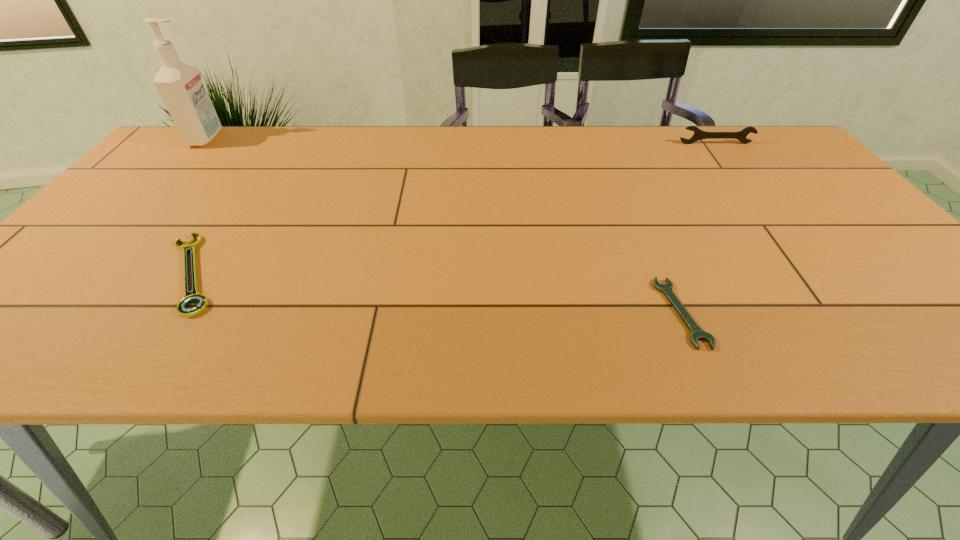
The width and height of the screenshot is (960, 540). Find the location of `object that is the third closest to the tallest wrench`. object that is the third closest to the tallest wrench is located at coordinates (179, 84).

Image resolution: width=960 pixels, height=540 pixels. Find the location of `object that stands as the closest to the third shortest object`. object that stands as the closest to the third shortest object is located at coordinates (696, 333).

What are the coordinates of `the second closest wrench to the tallest wrench` in the screenshot? It's located at (192, 298).

In order to click on wrench that is the closest to the second wrench from right to left in this screenshot , I will do `click(698, 134)`.

Where is `free space in the image that satisfies the following two spatial constraints: 1. on the front label of the third object from right to left; 2. on the right side of the cleansing agent`? free space in the image that satisfies the following two spatial constraints: 1. on the front label of the third object from right to left; 2. on the right side of the cleansing agent is located at coordinates (84, 273).

Find the location of a particular element. The width and height of the screenshot is (960, 540). free space that satisfies the following two spatial constraints: 1. on the back side of the leftmost wrench; 2. on the front label of the cleansing agent is located at coordinates (281, 138).

Find the location of a particular element. The height and width of the screenshot is (540, 960). free location that satisfies the following two spatial constraints: 1. on the back side of the third object from left to right; 2. on the front label of the tallest object is located at coordinates (608, 138).

Where is `free spot that satisfies the following two spatial constraints: 1. on the front label of the tallest object; 2. on the back side of the second object from right to left`? The width and height of the screenshot is (960, 540). free spot that satisfies the following two spatial constraints: 1. on the front label of the tallest object; 2. on the back side of the second object from right to left is located at coordinates (49, 313).

At what (x,y) coordinates should I click in order to perform the action: click on free spot that satisfies the following two spatial constraints: 1. on the front label of the second object from right to left; 2. on the right side of the tallest object. Please return your answer as a coordinate pair (x, y). Looking at the image, I should click on (49, 313).